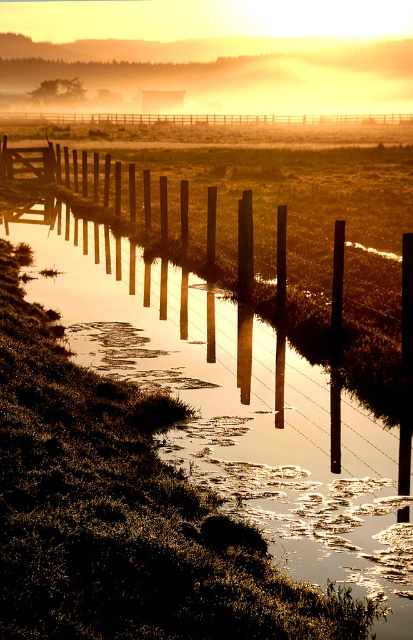
Based on the photo, you are standing at the camera position looking at the serene rural landscape. There is a point marked at coordinates point [239,122]. Can you reach that point by walking straight ahead without deviating from your path?

The point point [239,122] is 102.81 meters away from camera, so yes, you can reach it by walking straight ahead since there is no obstruction mentioned in the scene description.